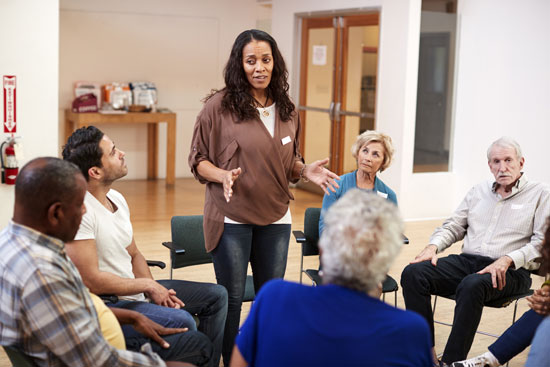
Locate an element on the screen. people sitting in chairs is located at coordinates (48, 251), (96, 195), (343, 306), (365, 155), (511, 186), (521, 321).